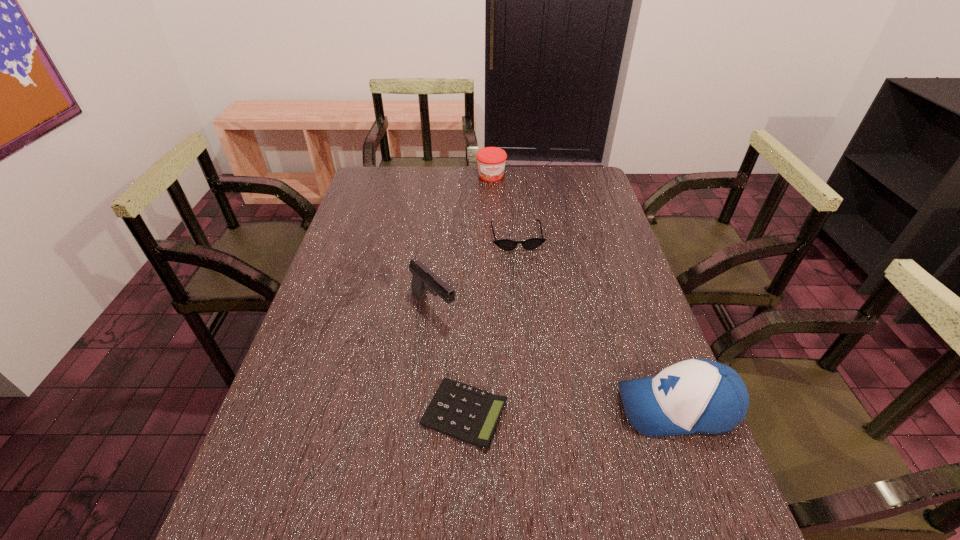
Where is `blank region between the pistol and the shortest object`? blank region between the pistol and the shortest object is located at coordinates (449, 360).

Find the location of `empty location between the jam and the rightmost object`. empty location between the jam and the rightmost object is located at coordinates pyautogui.click(x=584, y=292).

The image size is (960, 540). What are the coordinates of `free spot between the pistol and the jam` in the screenshot? It's located at (463, 241).

Locate an element on the screen. free point between the rightmost object and the shortest object is located at coordinates (570, 410).

This screenshot has height=540, width=960. Find the location of `free space between the shortest object and the sunglasses`. free space between the shortest object and the sunglasses is located at coordinates (491, 325).

Find the location of a particular element. This screenshot has height=540, width=960. free spot between the second shortest object and the third nearest object is located at coordinates (475, 272).

The image size is (960, 540). In order to click on object that ranks as the second closest to the sunglasses in this screenshot , I will do `click(491, 161)`.

The height and width of the screenshot is (540, 960). Identify the location of object that is the second closest to the third farthest object. (505, 244).

This screenshot has width=960, height=540. In order to click on free spot that satisfies the following two spatial constraints: 1. on the front side of the pistol; 2. on the front-facing side of the rightmost object in this screenshot , I will do `click(422, 408)`.

Find the location of a particular element. The image size is (960, 540). free point that satisfies the following two spatial constraints: 1. on the back side of the calculator; 2. on the right side of the jam is located at coordinates (471, 176).